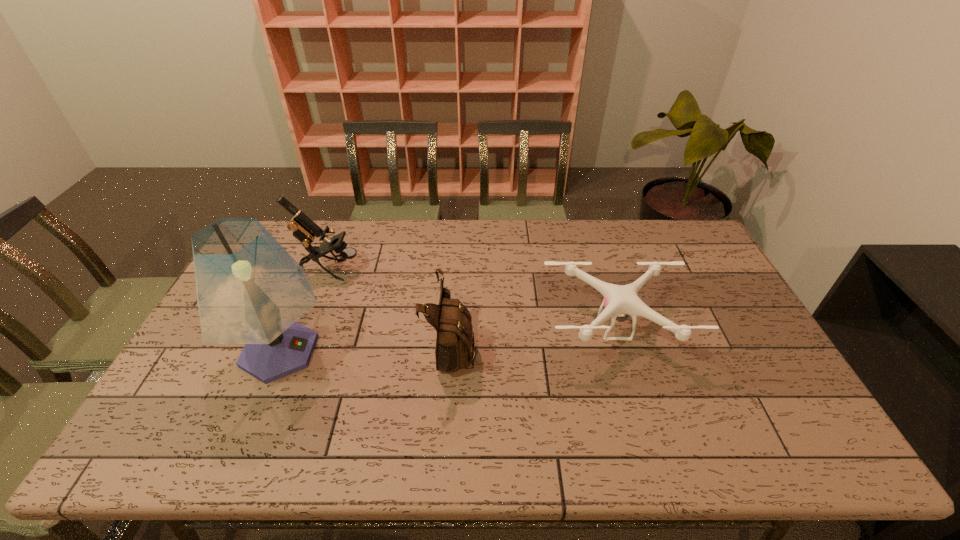
This screenshot has width=960, height=540. I want to click on vacant space that is in between the third object from left to right and the microscope, so click(391, 308).

Where is `vacant area that lies between the microscope and the second shortest object`? The height and width of the screenshot is (540, 960). vacant area that lies between the microscope and the second shortest object is located at coordinates (391, 308).

You are a GUI agent. You are given a task and a screenshot of the screen. Output one action in this format:
    pyautogui.click(x=<x>, y=<y>)
    Task: Click on the vacant area that lies between the rightmost object and the third object from left to right
    
    Given the screenshot: What is the action you would take?
    pyautogui.click(x=533, y=337)

This screenshot has height=540, width=960. In order to click on the third closest object to the farthest object in this screenshot , I will do `click(620, 301)`.

Where is `the closest object to the second object from right to left`? the closest object to the second object from right to left is located at coordinates (620, 301).

This screenshot has width=960, height=540. In order to click on free spot that satisfies the following two spatial constraints: 1. on the top of the rightmost object; 2. on the base of the lampshade in this screenshot , I will do `click(622, 352)`.

The image size is (960, 540). I want to click on vacant region that satisfies the following two spatial constraints: 1. on the top of the shortest object; 2. on the front-facing side of the second shortest object, so click(620, 346).